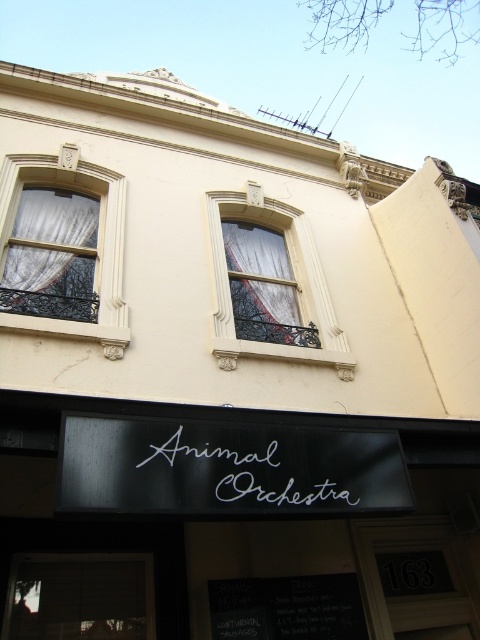
Question: Observing the image, what is the correct spatial positioning of white textured curtain at upper left in reference to white script at center?

Choices:
 (A) above
 (B) below

Answer: (A)

Question: Which object is the closest to the white textured curtain at upper left?

Choices:
 (A) white textured window at center
 (B) white sheer curtain at center
 (C) black matte signboard at center

Answer: (A)

Question: Does black matte signboard at center have a larger size compared to white sheer curtain at center?

Choices:
 (A) no
 (B) yes

Answer: (B)

Question: Which point is closer to the camera taking this photo?

Choices:
 (A) (310, 632)
 (B) (101, 269)

Answer: (A)

Question: Does black matte signboard at center lie in front of white sheer curtain at center?

Choices:
 (A) no
 (B) yes

Answer: (B)

Question: Which of the following is the farthest from the observer?

Choices:
 (A) (287, 216)
 (B) (247, 477)

Answer: (A)